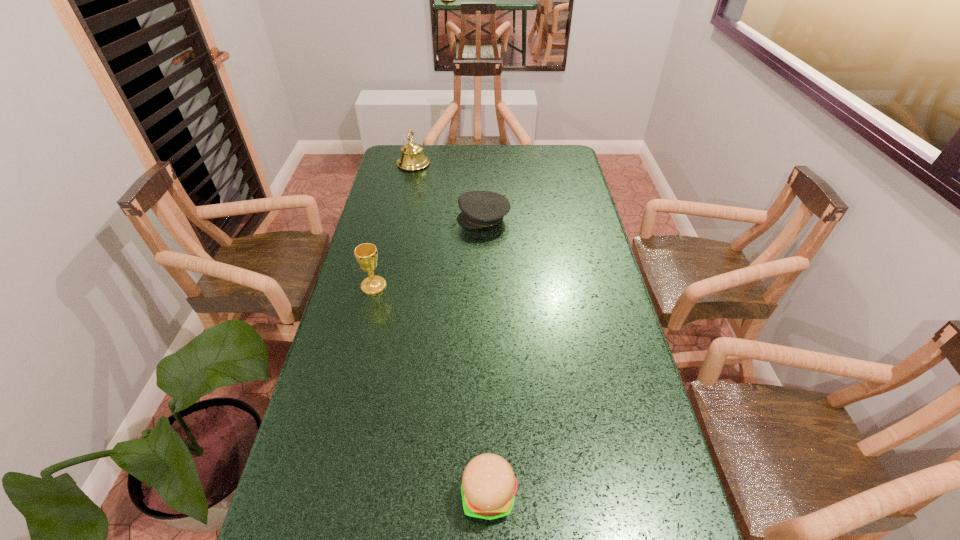
Identify the location of blank space that satisfies the following two spatial constraints: 1. on the back side of the hamburger; 2. on the front-facing side of the third nearest object. The image size is (960, 540). (485, 219).

Locate an element on the screen. free region that satisfies the following two spatial constraints: 1. on the back side of the farthest object; 2. on the right side of the second nearest object is located at coordinates (403, 164).

This screenshot has width=960, height=540. Find the location of `free space that satisfies the following two spatial constraints: 1. on the front-facing side of the beret; 2. on the left side of the nearest object`. free space that satisfies the following two spatial constraints: 1. on the front-facing side of the beret; 2. on the left side of the nearest object is located at coordinates (486, 495).

At what (x,y) coordinates should I click in order to perform the action: click on free spot that satisfies the following two spatial constraints: 1. on the front-facing side of the hamburger; 2. on the right side of the second farthest object. Please return your answer as a coordinate pair (x, y). Looking at the image, I should click on (486, 495).